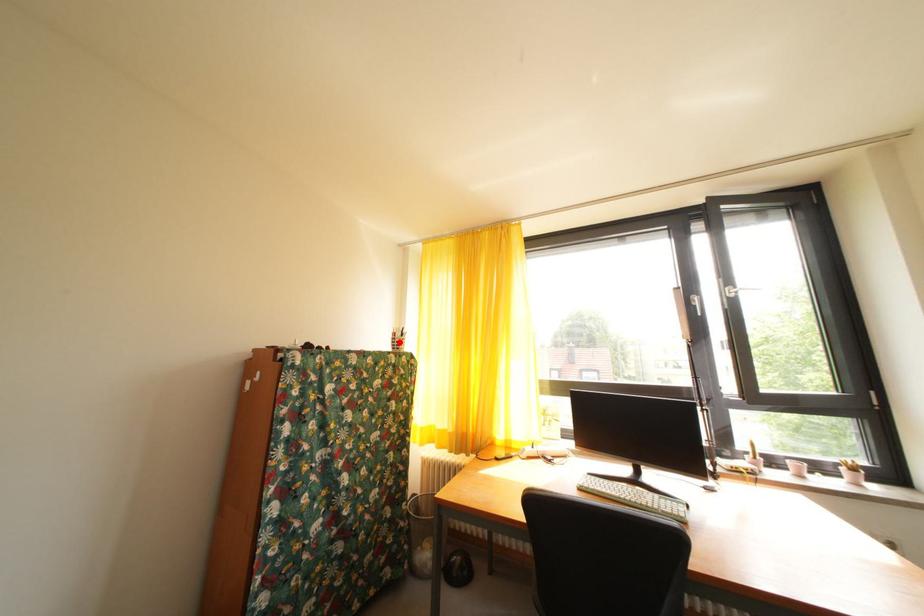
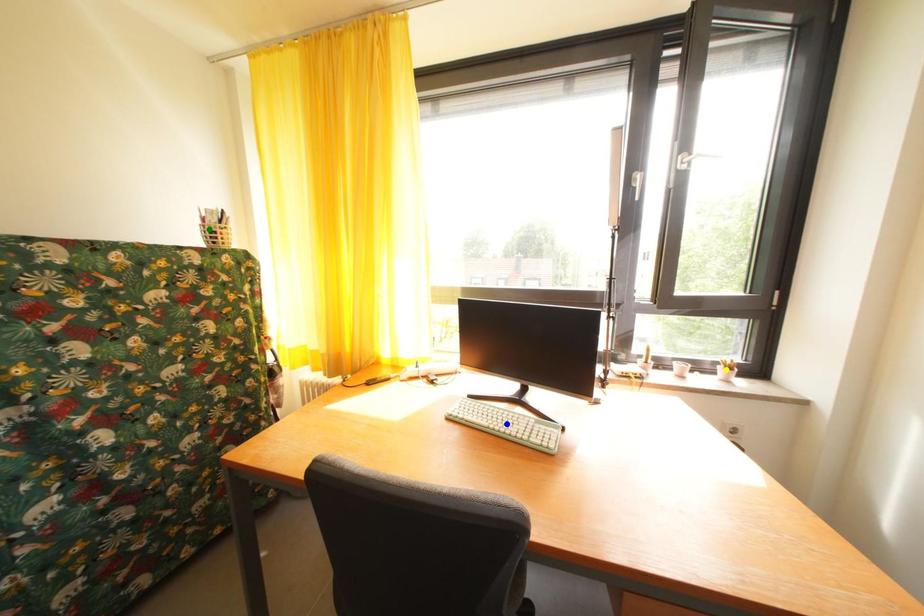
Question: I am providing you with two images of the same scene from different viewpoints. A red point is marked on the first image. You are given multiple points on the second image. Which spot in image 2 lines up with the point in image 1?

Choices:
 (A) green point
 (B) yellow point
 (C) blue point

Answer: (A)